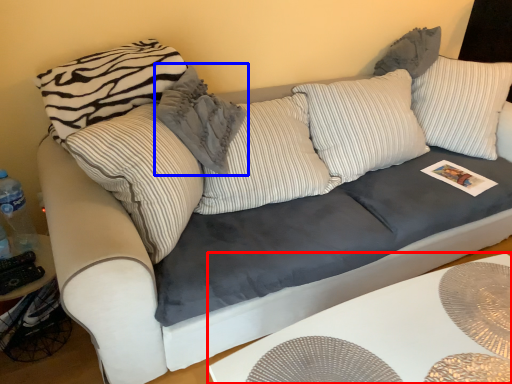
Question: Which point is further to the camera, table (highlighted by a red box) or pillow (highlighted by a blue box)?

Choices:
 (A) table
 (B) pillow

Answer: (B)